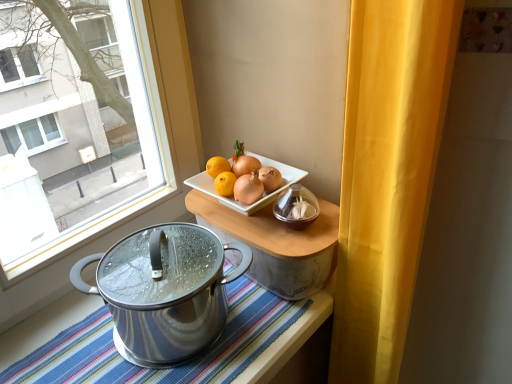
This screenshot has width=512, height=384. Describe the element at coordinates (276, 244) in the screenshot. I see `wooden tray at center` at that location.

Identify the location of striped fabric tablecloth at lower center. (298, 347).

The height and width of the screenshot is (384, 512). Describe the element at coordinates (387, 175) in the screenshot. I see `yellow fabric curtain at right` at that location.

At what (x,y) coordinates should I click in order to perform the action: click on wooden tray at center. Please return your answer as a coordinate pair (x, y). The width and height of the screenshot is (512, 384). Looking at the image, I should click on (276, 244).

In the scene shown: Visually, is wooden tray at center positioned to the left or to the right of striped fabric tablecloth at lower center?

From the image, it's evident that wooden tray at center is to the right of striped fabric tablecloth at lower center.

In the scene shown: Is wooden tray at center turned away from striped fabric tablecloth at lower center?

No, wooden tray at center's orientation is not away from striped fabric tablecloth at lower center.

Find the location of a particular element. The height and width of the screenshot is (384, 512). table above the striped fabric tablecloth at lower center (from the image's perspective) is located at coordinates (276, 244).

The width and height of the screenshot is (512, 384). I want to click on kitchen appliance behind the yellow fabric curtain at right, so click(x=164, y=291).

From a real-world perspective, is yellow fabric curtain at right on polished stainless steel pot at lower left?

No, from a real-world perspective, yellow fabric curtain at right is not above polished stainless steel pot at lower left.

In terms of size, does yellow fabric curtain at right appear bigger or smaller than polished stainless steel pot at lower left?

Clearly, yellow fabric curtain at right is larger in size than polished stainless steel pot at lower left.

Is yellow fabric curtain at right completely or partially outside of polished stainless steel pot at lower left?

Yes.

In the image, is striped fabric tablecloth at lower center positioned in front of or behind yellow fabric curtain at right?

striped fabric tablecloth at lower center is positioned farther from the viewer than yellow fabric curtain at right.

What are the coordinates of `curtain below the striped fabric tablecloth at lower center (from a real-world perspective)` in the screenshot? It's located at (387, 175).

Which object is wider, striped fabric tablecloth at lower center or yellow fabric curtain at right?

yellow fabric curtain at right is wider.

Considering the sizes of polished stainless steel pot at lower left and striped fabric tablecloth at lower center in the image, is polished stainless steel pot at lower left bigger or smaller than striped fabric tablecloth at lower center?

Result: In the image, polished stainless steel pot at lower left appears to be smaller than striped fabric tablecloth at lower center.

Measure the distance between polished stainless steel pot at lower left and striped fabric tablecloth at lower center.

polished stainless steel pot at lower left and striped fabric tablecloth at lower center are 20.87 centimeters apart from each other.

Which is behind, polished stainless steel pot at lower left or striped fabric tablecloth at lower center?

polished stainless steel pot at lower left is further away from the camera.

Is striped fabric tablecloth at lower center at the back of polished stainless steel pot at lower left?

polished stainless steel pot at lower left does not have its back to striped fabric tablecloth at lower center.

Does striped fabric tablecloth at lower center have a smaller size compared to polished stainless steel pot at lower left?

Incorrect, striped fabric tablecloth at lower center is not smaller in size than polished stainless steel pot at lower left.

In the image, is striped fabric tablecloth at lower center positioned in front of or behind polished stainless steel pot at lower left?

striped fabric tablecloth at lower center is in front of polished stainless steel pot at lower left.

Based on the photo, considering the sizes of striped fabric tablecloth at lower center and polished stainless steel pot at lower left in the image, is striped fabric tablecloth at lower center taller or shorter than polished stainless steel pot at lower left?

Clearly, striped fabric tablecloth at lower center is shorter compared to polished stainless steel pot at lower left.

Considering the relative positions of striped fabric tablecloth at lower center and polished stainless steel pot at lower left in the image provided, is striped fabric tablecloth at lower center to the right of polished stainless steel pot at lower left from the viewer's perspective?

In fact, striped fabric tablecloth at lower center is to the left of polished stainless steel pot at lower left.

From the picture: Is polished stainless steel pot at lower left facing towards yellow fabric curtain at right?

No.

How much distance is there between polished stainless steel pot at lower left and yellow fabric curtain at right?

polished stainless steel pot at lower left and yellow fabric curtain at right are 12.30 inches apart.

From a real-world perspective, is polished stainless steel pot at lower left below yellow fabric curtain at right?

Actually, polished stainless steel pot at lower left is physically above yellow fabric curtain at right in the real world.

Is point (208, 236) closer or farther from the camera than point (336, 327)?

Point (208, 236) is closer to the camera than point (336, 327).

From the image's perspective, is wooden tray at center beneath yellow fabric curtain at right?

No, from the image's perspective, wooden tray at center is not below yellow fabric curtain at right.

From a real-world perspective, which object rests below the other?

yellow fabric curtain at right, from a real-world perspective.

Based on the photo, relative to yellow fabric curtain at right, is wooden tray at center in front or behind?

Visually, wooden tray at center is located behind yellow fabric curtain at right.

Locate an element on the screen. The height and width of the screenshot is (384, 512). curtain in front of the wooden tray at center is located at coordinates (387, 175).

The height and width of the screenshot is (384, 512). What are the coordinates of `table on the right of striped fabric tablecloth at lower center` in the screenshot? It's located at (276, 244).

Find the location of a particular element. curtain in front of the polished stainless steel pot at lower left is located at coordinates (387, 175).

Which object lies further to the anchor point wooden tray at center, polished stainless steel pot at lower left or yellow fabric curtain at right?

yellow fabric curtain at right lies further to wooden tray at center than the other object.

From the image, which object appears to be farther from wooden tray at center, polished stainless steel pot at lower left or striped fabric tablecloth at lower center?

The object further to wooden tray at center is striped fabric tablecloth at lower center.

Based on their spatial positions, is polished stainless steel pot at lower left or wooden tray at center further from yellow fabric curtain at right?

polished stainless steel pot at lower left.

From the image, which object appears to be nearer to polished stainless steel pot at lower left, striped fabric tablecloth at lower center or yellow fabric curtain at right?

striped fabric tablecloth at lower center lies closer to polished stainless steel pot at lower left than the other object.

From the image, which object appears to be farther from yellow fabric curtain at right, striped fabric tablecloth at lower center or polished stainless steel pot at lower left?

polished stainless steel pot at lower left.

When comparing their distances from striped fabric tablecloth at lower center, does polished stainless steel pot at lower left or yellow fabric curtain at right seem further?

Based on the image, polished stainless steel pot at lower left appears to be further to striped fabric tablecloth at lower center.

Estimate the real-world distances between objects in this image. Which object is closer to polished stainless steel pot at lower left, yellow fabric curtain at right or wooden tray at center?

Based on the image, wooden tray at center appears to be nearer to polished stainless steel pot at lower left.

Which object lies nearer to the anchor point polished stainless steel pot at lower left, wooden tray at center or yellow fabric curtain at right?

wooden tray at center lies closer to polished stainless steel pot at lower left than the other object.

Locate an element on the screen. table between polished stainless steel pot at lower left and yellow fabric curtain at right is located at coordinates (276, 244).

You are a GUI agent. You are given a task and a screenshot of the screen. Output one action in this format:
    pyautogui.click(x=<x>, y=<y>)
    Task: Click on the table located between striped fabric tablecloth at lower center and yellow fabric curtain at right in the left-right direction
    The image size is (512, 384).
    Given the screenshot: What is the action you would take?
    pyautogui.click(x=276, y=244)

The image size is (512, 384). I want to click on kitchen appliance between wooden tray at center and striped fabric tablecloth at lower center in the up-down direction, so click(164, 291).

In order to click on kitchen appliance located between striped fabric tablecloth at lower center and yellow fabric curtain at right in the left-right direction in this screenshot , I will do `click(164, 291)`.